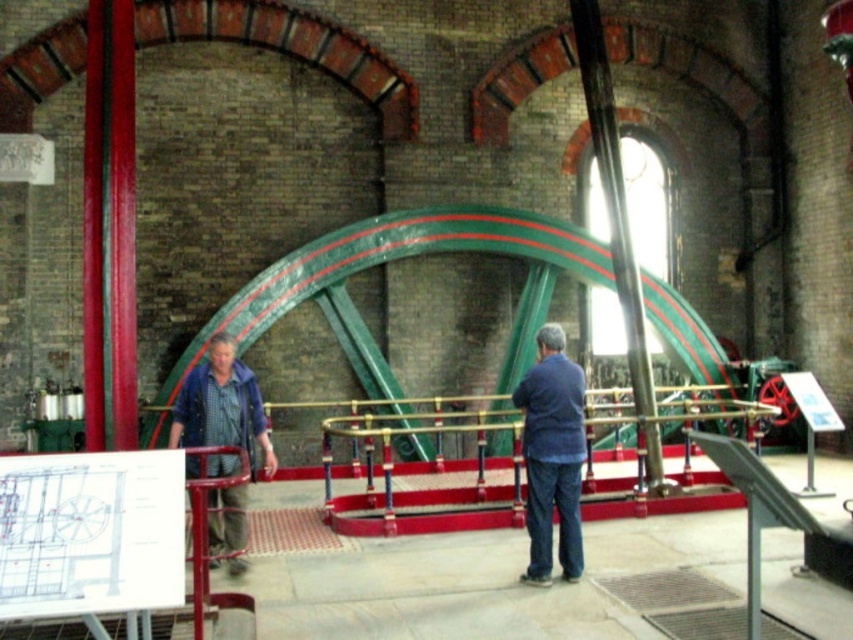
Question: Estimate the real-world distances between objects in this image. Which object is closer to the polished brass railing at center?

Choices:
 (A) blue denim jacket at center
 (B) denim jacket at left

Answer: (B)

Question: Which point appears farthest from the camera in this image?

Choices:
 (A) 544,461
 (B) 221,397
 (C) 456,470

Answer: (C)

Question: Does polished brass railing at center have a lesser width compared to blue denim jacket at center?

Choices:
 (A) yes
 (B) no

Answer: (A)

Question: Which of the following is the closest to the observer?

Choices:
 (A) (378, 435)
 (B) (554, 451)
 (C) (233, 424)

Answer: (B)

Question: Is the position of polished brass railing at center more distant than that of denim jacket at left?

Choices:
 (A) yes
 (B) no

Answer: (A)

Question: Can you confirm if polished brass railing at center is bigger than denim jacket at left?

Choices:
 (A) no
 (B) yes

Answer: (A)